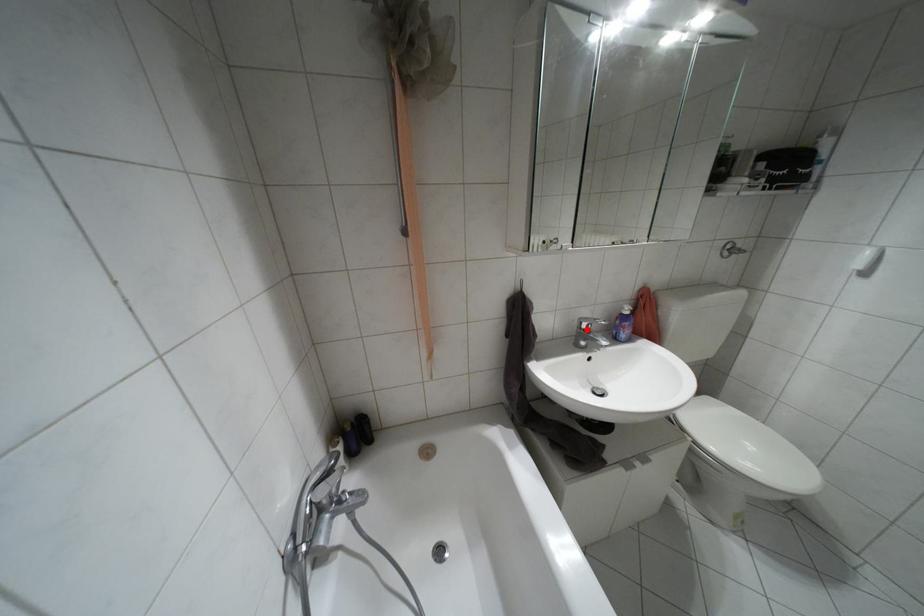
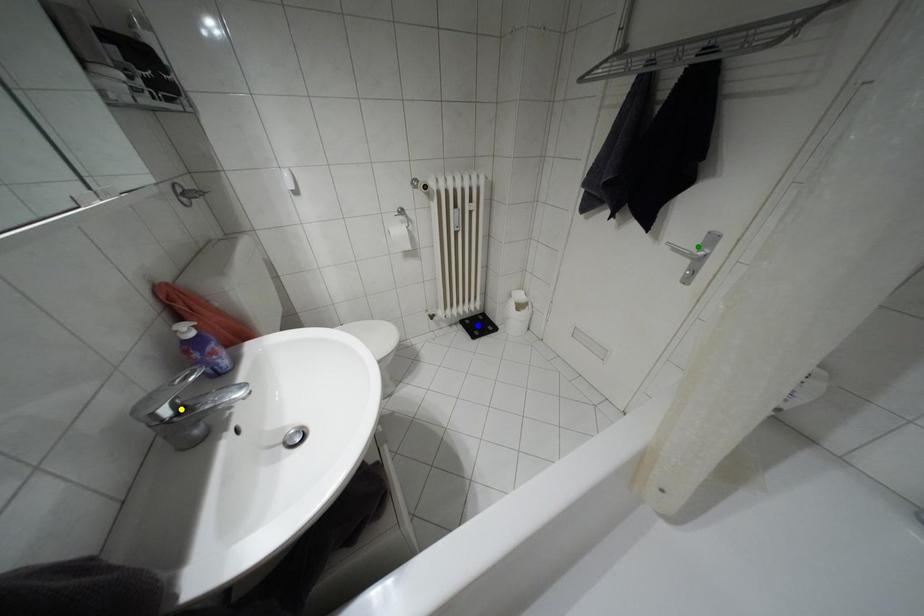
Question: I am providing you with two images of the same scene from different viewpoints. A red point is marked on the first image. You are given multiple points on the second image. Which spot in image 2 lines up with the point in image 1?

Choices:
 (A) green point
 (B) yellow point
 (C) blue point

Answer: (B)